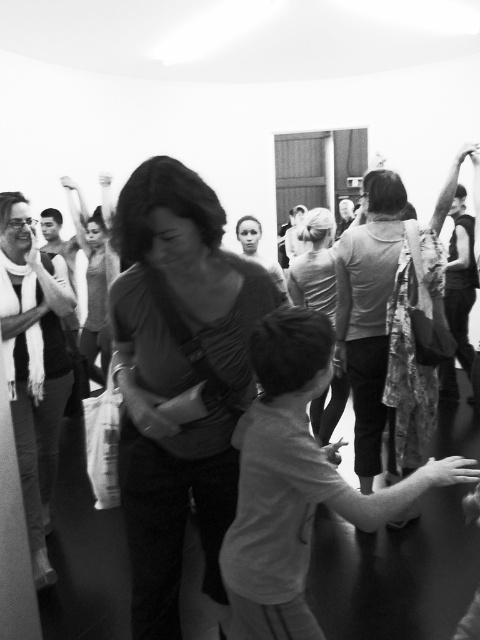
Question: Does matte gray shirt at center appear on the right side of matte black shirt at center?

Choices:
 (A) yes
 (B) no

Answer: (A)

Question: Estimate the real-world distances between objects in this image. Which object is closer to the matte gray shirt at center?

Choices:
 (A) white matte shirt at center
 (B) smooth gray sweater at center

Answer: (A)

Question: Can you confirm if matte gray shirt at center is wider than white matte shirt at center?

Choices:
 (A) no
 (B) yes

Answer: (A)

Question: Which of these objects is positioned closest to the matte gray shirt at center?

Choices:
 (A) white matte shirt at center
 (B) matte black shirt at center

Answer: (A)

Question: Is the position of white matte shirt at center less distant than that of matte black shirt at center?

Choices:
 (A) no
 (B) yes

Answer: (B)

Question: Which point appears farthest from the camera in this image?

Choices:
 (A) (145, 282)
 (B) (256, 360)
 (C) (252, 241)
 (D) (35, 502)

Answer: (C)